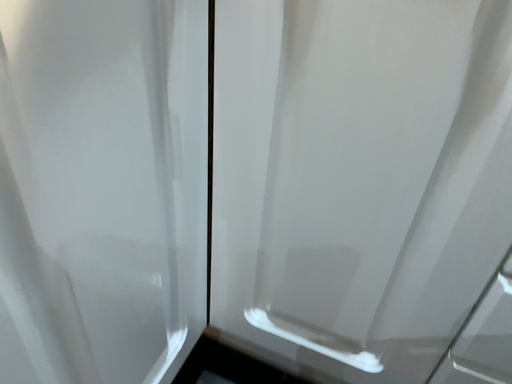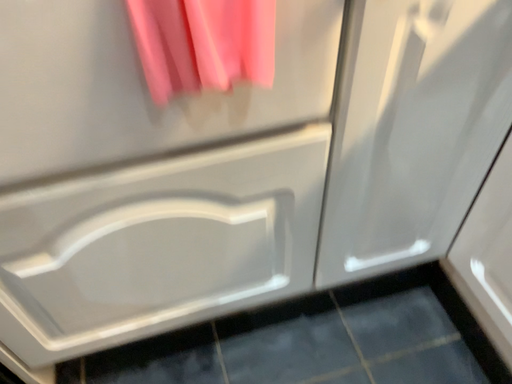
Question: How did the camera likely rotate when shooting the video?

Choices:
 (A) rotated right
 (B) rotated left

Answer: (B)